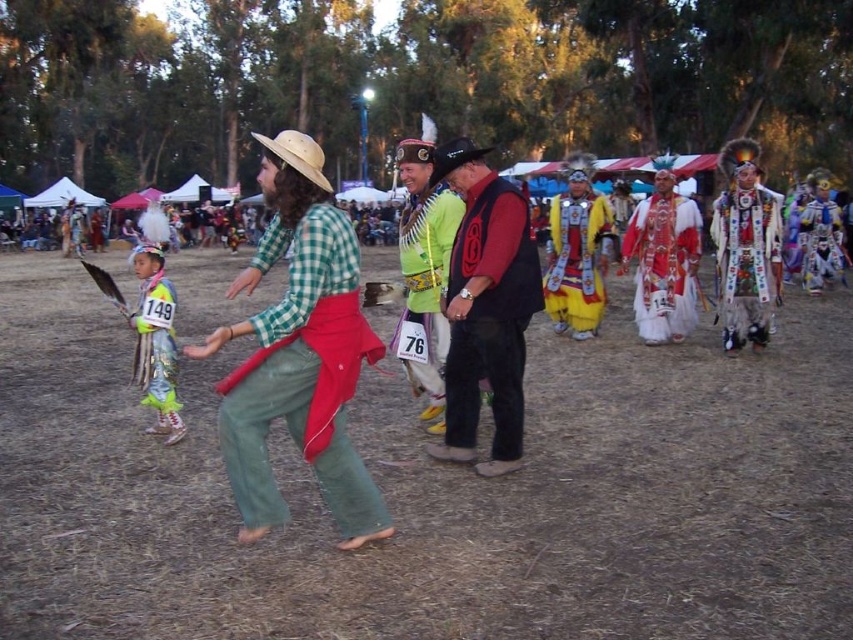
You are a photographer at the event and want to capture both the green plaid shirt at center and the embroidered velvet robe at right in a single frame. Which clothing item should you focus on first to ensure both are in the shot?

The green plaid shirt at center is shorter than the embroidered velvet robe at right, so you should focus on the embroidered velvet robe at right first to ensure both are fully visible in the frame.

You are a photographer positioned at the origin point of the coordinate system. You want to capture a photo of the brown dry grass at center. What are the coordinates where you should aim your camera?

The coordinates for the brown dry grass at center are at point (x=434, y=492).